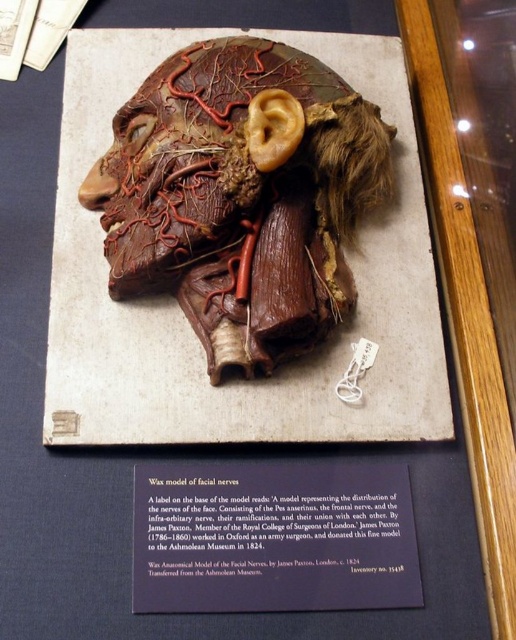
You are a museum visitor observing the wax anatomical model of the facial nerves. You notice the matte brown wax model of facial nerves at center and the purple paper at center. Which object is taller?

The matte brown wax model of facial nerves at center is taller than the purple paper at center.

You are a museum visitor observing the wax anatomical model of the facial nerves. You notice the matte brown wax model of facial nerves at center and the purple paper at center. Which object takes up more space in the scene?

The matte brown wax model of facial nerves at center is larger in size than the purple paper at center, so it takes up more space in the scene.

You are a museum curator planning to display both the matte brown wax model of facial nerves at center and the purple paper at center in a new exhibit. Which object will require a wider display space?

The matte brown wax model of facial nerves at center requires a wider display space because its width is larger than the purple paper at center.